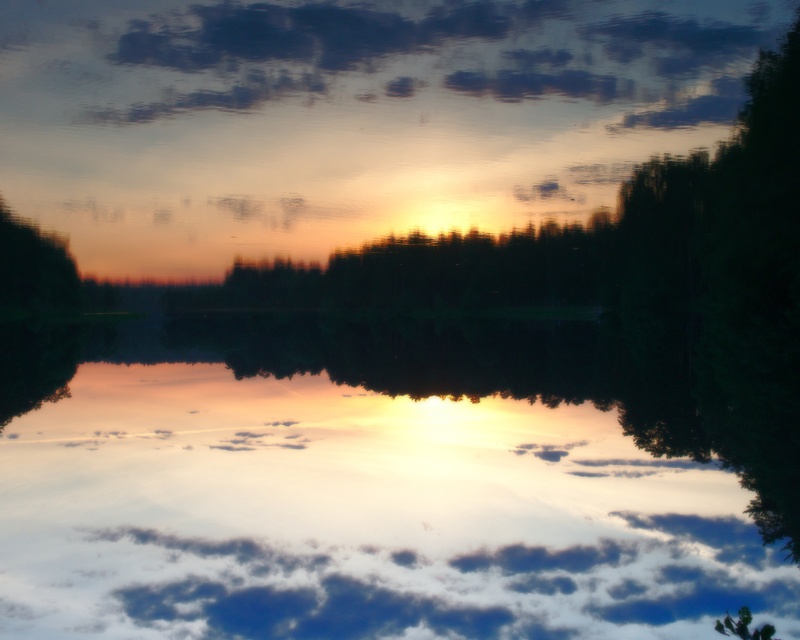
You are an artist trying to paint the sunset scene. You have to decide which object to paint first based on their size. Which object should you start with, the transparent water at center or the green matte tree at left?

The transparent water at center is larger in size than the green matte tree at left, so you should start painting the transparent water at center first.

You are standing at the point closer to the camera in the scene. Which point are you at, point (225, 356) or point (478, 54)?

You are at point (225, 356) because it is closer to the camera than point (478, 54).

You are an artist trying to paint the sunset scene. You notice the cloudy sky at upper center and the green matte tree at left. Which object in the scene is taller?

The cloudy sky at upper center is taller than the green matte tree at left.